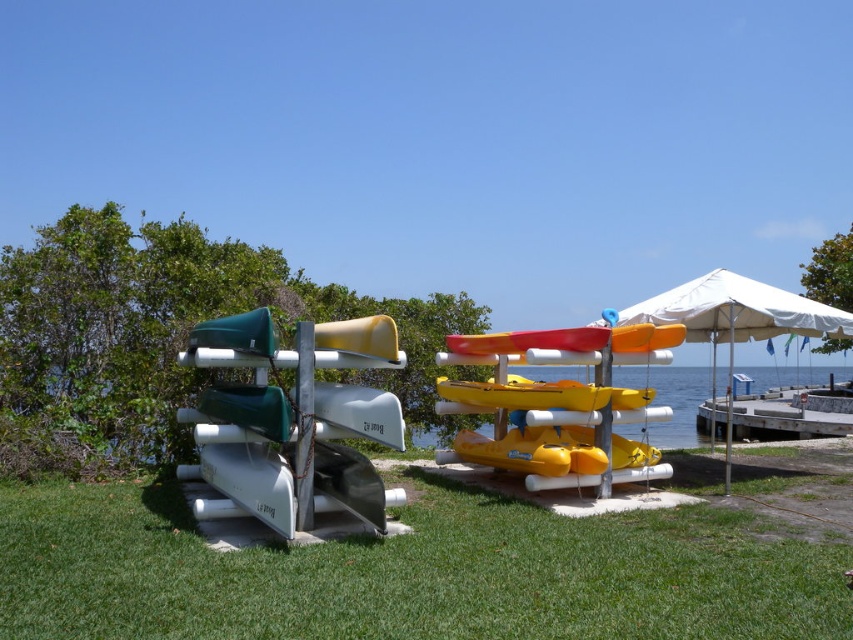
Between green grass at center and white fabric umbrella at center, which one has more height?

white fabric umbrella at center is taller.

The height and width of the screenshot is (640, 853). What do you see at coordinates (407, 572) in the screenshot?
I see `green grass at center` at bounding box center [407, 572].

Image resolution: width=853 pixels, height=640 pixels. Identify the location of green grass at center. (407, 572).

Does point (569, 442) lie behind point (850, 417)?

No, (569, 442) is closer to viewer.

At what (x,y) coordinates should I click in order to perform the action: click on yellow matte kayak at center. Please return your answer as a coordinate pair (x, y). Looking at the image, I should click on (558, 403).

Locate an element on the screen. The image size is (853, 640). yellow matte kayak at center is located at coordinates (558, 403).

Is point (397, 547) positioned in front of point (370, 397)?

Yes.

Who is lower down, green grass at center or green matte kayak at left?

green grass at center is lower down.

Where is `green grass at center`? This screenshot has width=853, height=640. green grass at center is located at coordinates (407, 572).